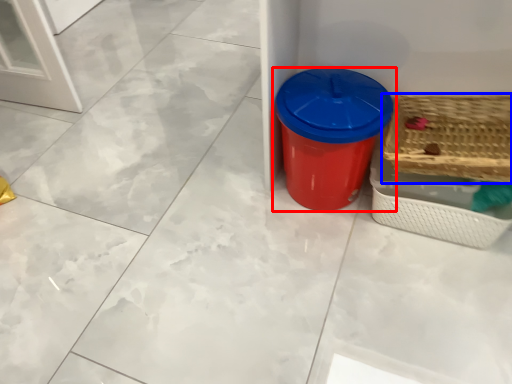
Question: Which object is further to the camera taking this photo, waste container (highlighted by a red box) or basket (highlighted by a blue box)?

Choices:
 (A) waste container
 (B) basket

Answer: (A)